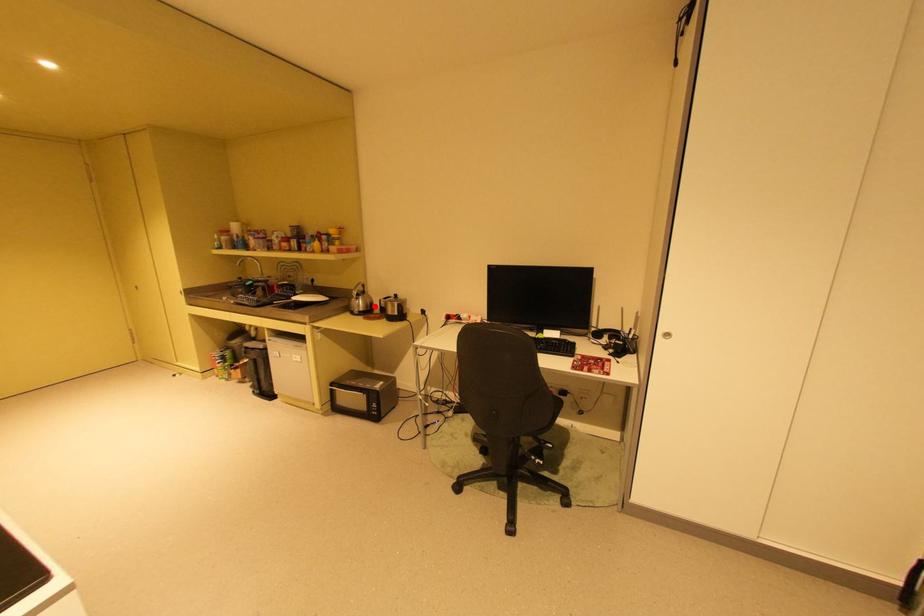
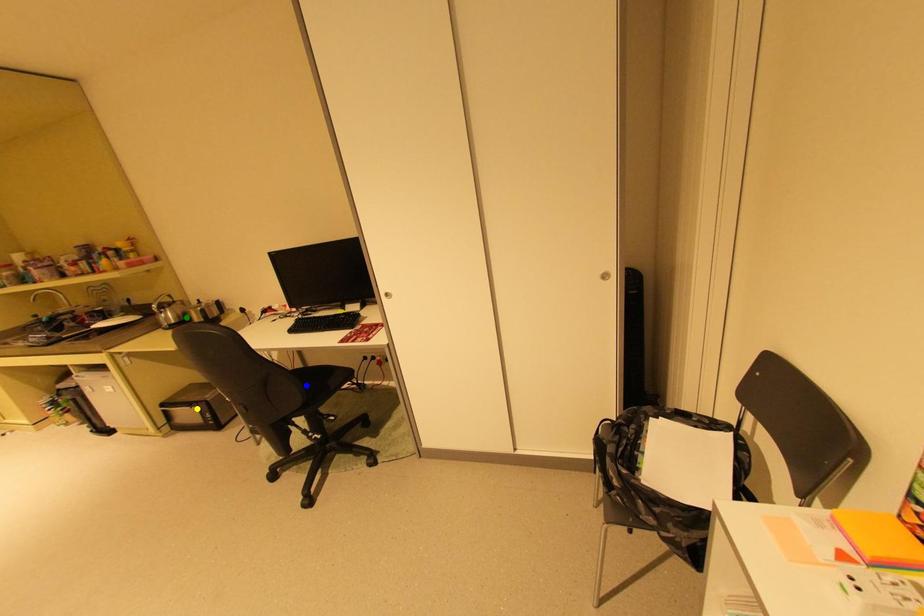
Question: I am providing you with two images of the same scene from different viewpoints. A red point is marked on the first image. You are given multiple points on the second image. Which point in image 2 is actually the same real-world point as the red point in image 1?

Choices:
 (A) green point
 (B) blue point
 (C) yellow point

Answer: (A)